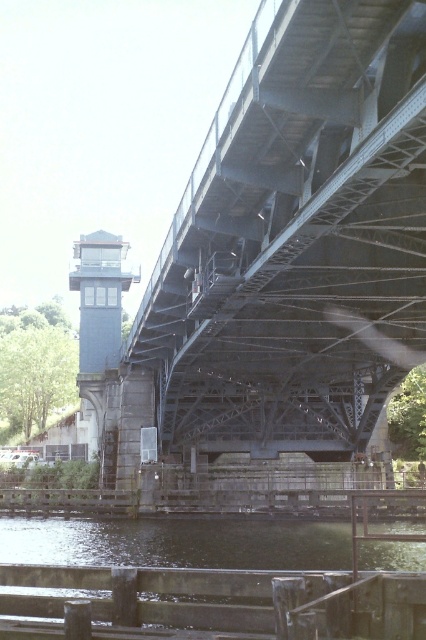
You are standing on the bridge and looking at two points marked on the image. The first point is at coordinates point (236, 81) and the second is at point (36, 621). Which point is closer to your viewpoint?

Point (236, 81) is further to the camera than point (36, 621), so the point closer to your viewpoint is point (36, 621).

You are standing at the point with coordinates (288, 250). Looking around, you see the metallic gray bridge at center. Can you tell me what is located at your current position?

The metallic gray bridge at center is located at point (288, 250), so you are standing on the metallic gray bridge at center.